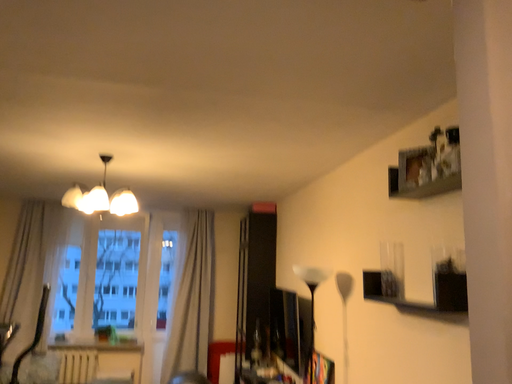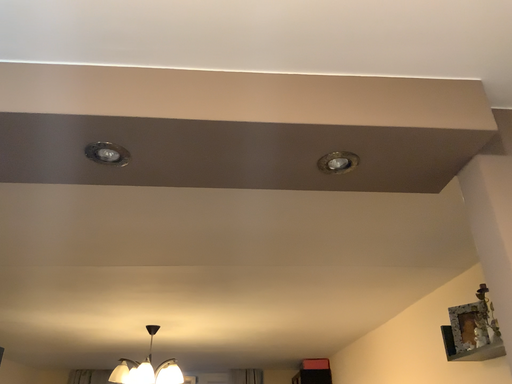
Question: Which way did the camera rotate in the video?

Choices:
 (A) rotated downward
 (B) rotated upward

Answer: (B)